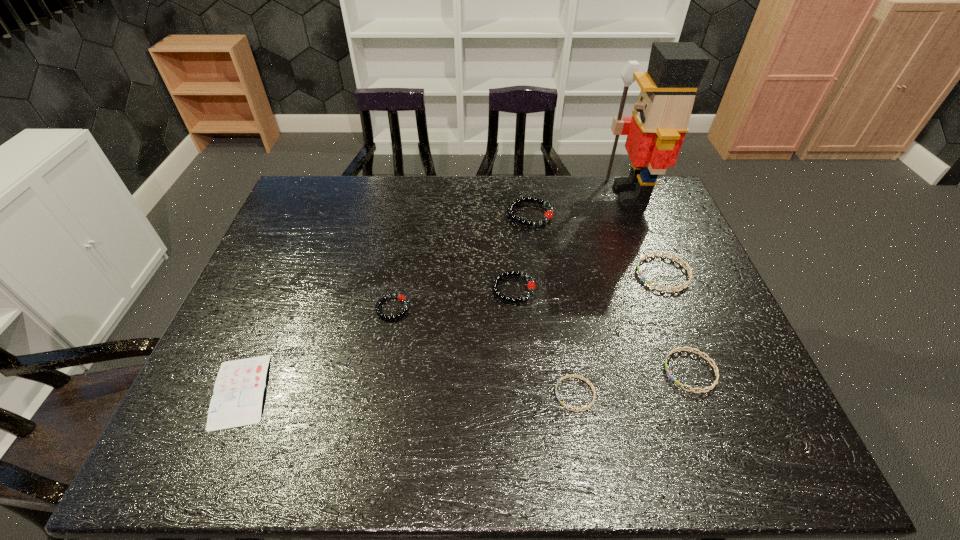
The height and width of the screenshot is (540, 960). Identify the location of free region located on the front of the second smallest black bracelet. (516, 320).

Locate an element on the screen. The height and width of the screenshot is (540, 960). free location located on the surface of the second biggest blue bracelet showing star-shaped elements is located at coordinates point(631,371).

The height and width of the screenshot is (540, 960). I want to click on vacant space situated on the surface of the second biggest blue bracelet showing star-shaped elements, so click(554, 371).

Find the location of a particular element. free spot located 0.360m on the surface of the second biggest blue bracelet showing star-shaped elements is located at coordinates (511, 371).

Where is `vacant area located 0.300m on the front of the leftmost bracelet`? This screenshot has height=540, width=960. vacant area located 0.300m on the front of the leftmost bracelet is located at coordinates (371, 435).

At what (x,y) coordinates should I click in order to perform the action: click on vacant space located on the surface of the smallest blue bracelet showing star-shaped elements. Please return your answer as a coordinate pair (x, y). Image resolution: width=960 pixels, height=540 pixels. Looking at the image, I should click on (453, 394).

Find the location of a particular element. The width and height of the screenshot is (960, 540). vacant area located on the surface of the smallest blue bracelet showing star-shaped elements is located at coordinates (457, 394).

Identify the location of free space located on the surface of the smallest blue bracelet showing star-shaped elements. (506, 394).

The image size is (960, 540). In order to click on vacant region located on the right of the shortest object in this screenshot , I will do `click(348, 391)`.

Identify the location of nutcracker that is at the far edge. The image size is (960, 540). (655, 132).